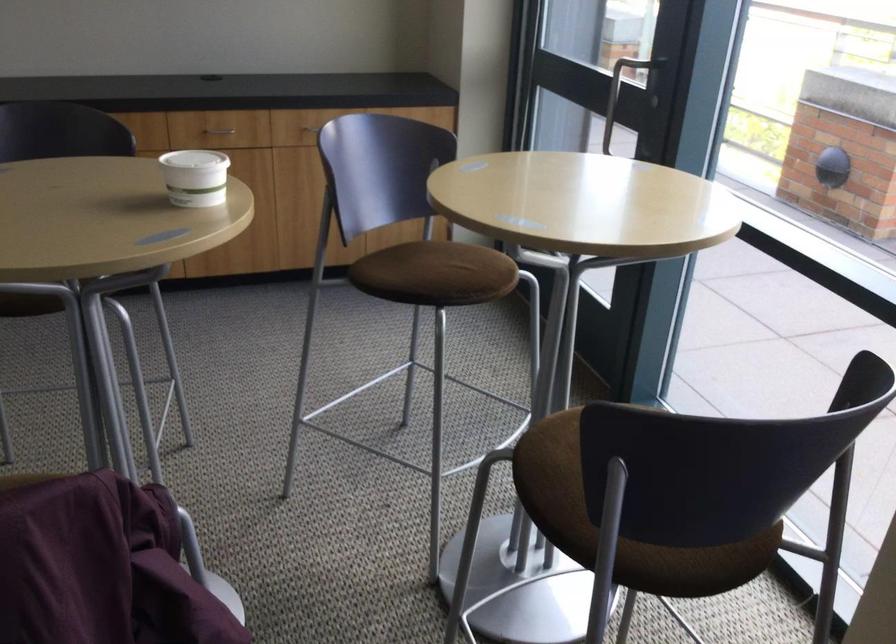
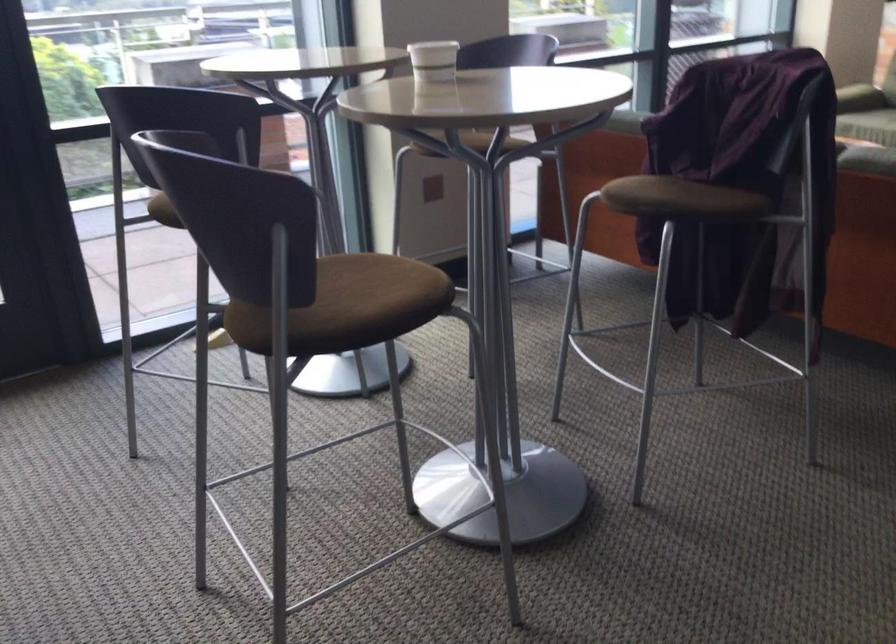
Find the pixel in the second image that matches point (194, 178) in the first image.

(433, 61)